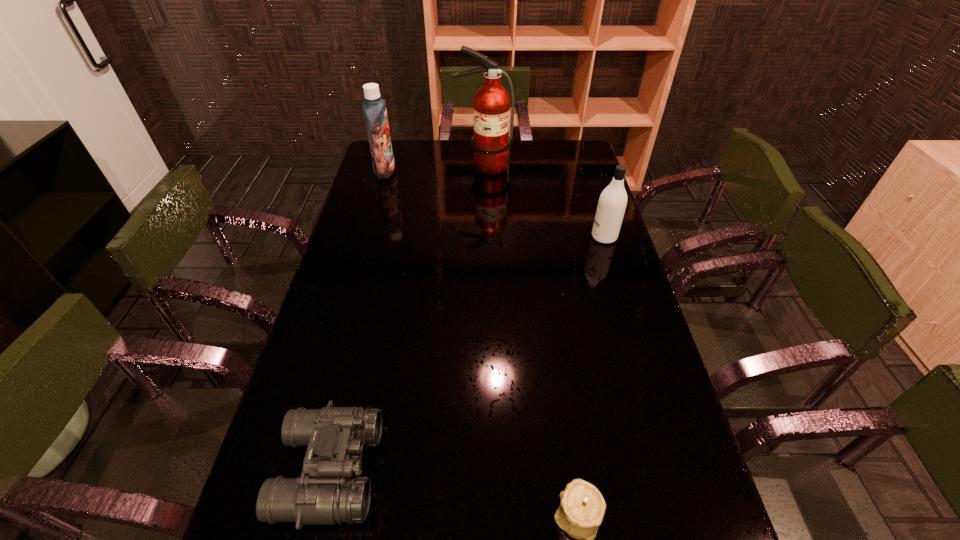
Identify the location of the third object from left to right. The width and height of the screenshot is (960, 540). (491, 105).

Where is `fire extinguisher`? The width and height of the screenshot is (960, 540). fire extinguisher is located at coordinates (491, 105).

In order to click on the left shampoo in this screenshot , I will do (374, 107).

What are the coordinates of `the taller shampoo` in the screenshot? It's located at click(x=374, y=107).

Identify the location of the right shampoo. The width and height of the screenshot is (960, 540). (612, 202).

Identify the location of the third shortest object. (612, 202).

The image size is (960, 540). What are the coordinates of `binoculars` in the screenshot? It's located at (325, 494).

Find the location of `free space located on the nozzle and handle of the tallest object`. free space located on the nozzle and handle of the tallest object is located at coordinates (484, 208).

You are a GUI agent. You are given a task and a screenshot of the screen. Output one action in this format:
    pyautogui.click(x=<x>, y=<y>)
    Task: Click on the vacant space located on the front label of the farther shampoo
    The height and width of the screenshot is (540, 960).
    Given the screenshot: What is the action you would take?
    pyautogui.click(x=471, y=171)

Image resolution: width=960 pixels, height=540 pixels. Identify the location of free spot located on the front-facing side of the nearer shampoo. (564, 237).